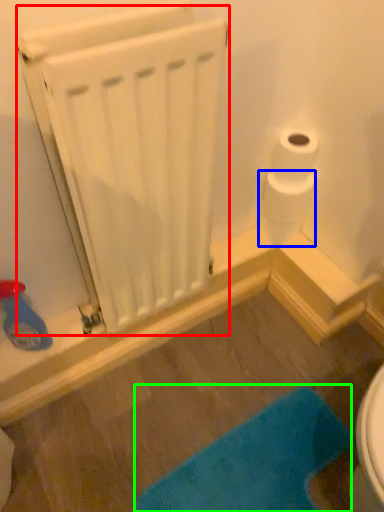
Question: Which object is the closest to the radiator (highlighted by a red box)? Choose among these: toilet paper (highlighted by a blue box) or bath mat (highlighted by a green box).

Choices:
 (A) toilet paper
 (B) bath mat

Answer: (A)